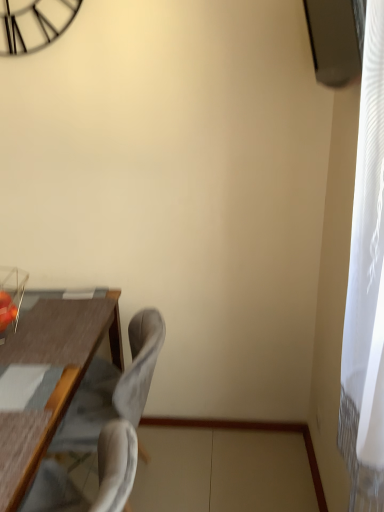
Question: From the image's perspective, is suede-like gray chair at center-left located beneath gray fabric swivel chair at lower left?

Choices:
 (A) yes
 (B) no

Answer: (B)

Question: Does suede-like gray chair at center-left lie in front of gray fabric swivel chair at lower left?

Choices:
 (A) no
 (B) yes

Answer: (A)

Question: Can you confirm if suede-like gray chair at center-left is wider than gray fabric swivel chair at lower left?

Choices:
 (A) yes
 (B) no

Answer: (A)

Question: Is suede-like gray chair at center-left smaller than gray fabric swivel chair at lower left?

Choices:
 (A) no
 (B) yes

Answer: (A)

Question: Is suede-like gray chair at center-left thinner than gray fabric swivel chair at lower left?

Choices:
 (A) no
 (B) yes

Answer: (A)

Question: Considering the relative positions of suede-like gray chair at center-left and gray fabric swivel chair at lower left in the image provided, is suede-like gray chair at center-left behind gray fabric swivel chair at lower left?

Choices:
 (A) no
 (B) yes

Answer: (B)

Question: Is gray fabric swivel chair at lower left located outside suede-like gray chair at center-left?

Choices:
 (A) no
 (B) yes

Answer: (B)

Question: From the image's perspective, is gray fabric swivel chair at lower left on suede-like gray chair at center-left?

Choices:
 (A) yes
 (B) no

Answer: (B)

Question: Is suede-like gray chair at center-left inside gray fabric swivel chair at lower left?

Choices:
 (A) no
 (B) yes

Answer: (A)

Question: Is gray fabric swivel chair at lower left looking in the opposite direction of suede-like gray chair at center-left?

Choices:
 (A) yes
 (B) no

Answer: (B)

Question: Is gray fabric swivel chair at lower left far away from suede-like gray chair at center-left?

Choices:
 (A) no
 (B) yes

Answer: (A)

Question: From the image's perspective, is gray fabric swivel chair at lower left under suede-like gray chair at center-left?

Choices:
 (A) yes
 (B) no

Answer: (A)

Question: From a real-world perspective, is gray fabric swivel chair at lower left positioned above or below suede-like gray chair at center-left?

Choices:
 (A) below
 (B) above

Answer: (B)